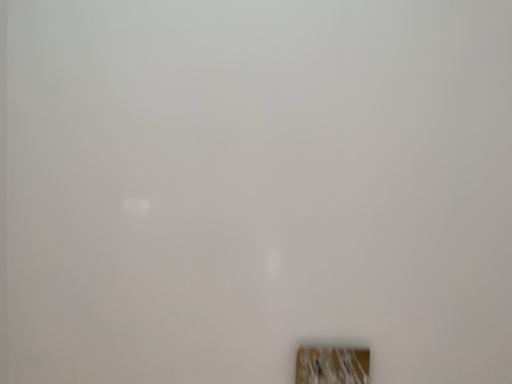
Identify the location of wooden picture frame at lower right. (332, 365).

Image resolution: width=512 pixels, height=384 pixels. What do you see at coordinates (332, 365) in the screenshot?
I see `wooden picture frame at lower right` at bounding box center [332, 365].

What is the approximate width of wooden picture frame at lower right?

wooden picture frame at lower right is 12.63 inches wide.

Locate an element on the screen. The image size is (512, 384). wooden picture frame at lower right is located at coordinates 332,365.